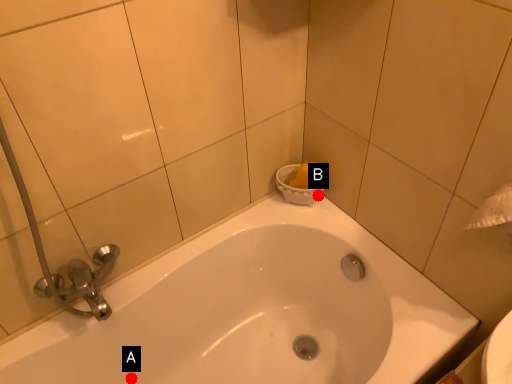
Question: Two points are circled on the image, labeled by A and B beside each circle. Which point is farther from the camera taking this photo?

Choices:
 (A) A is further
 (B) B is further

Answer: (B)